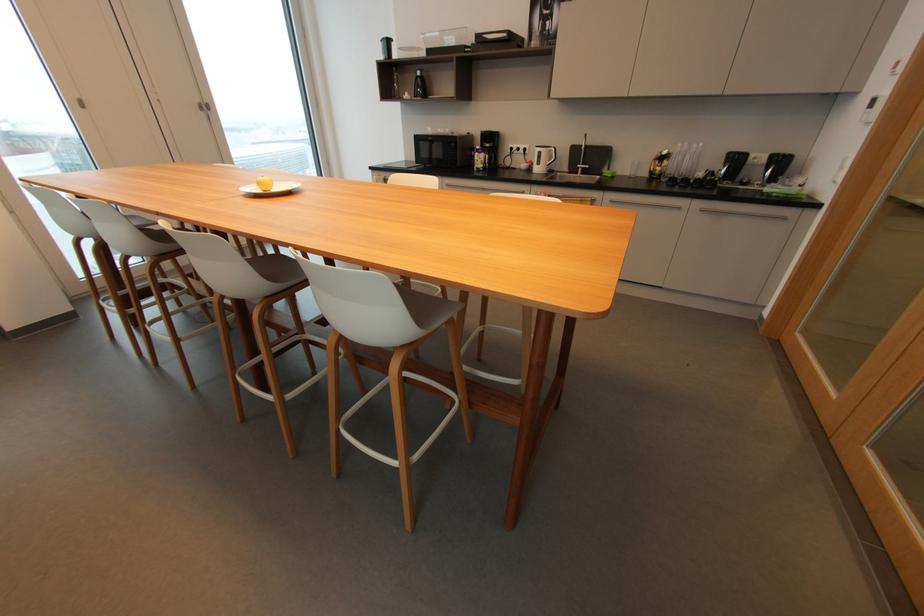
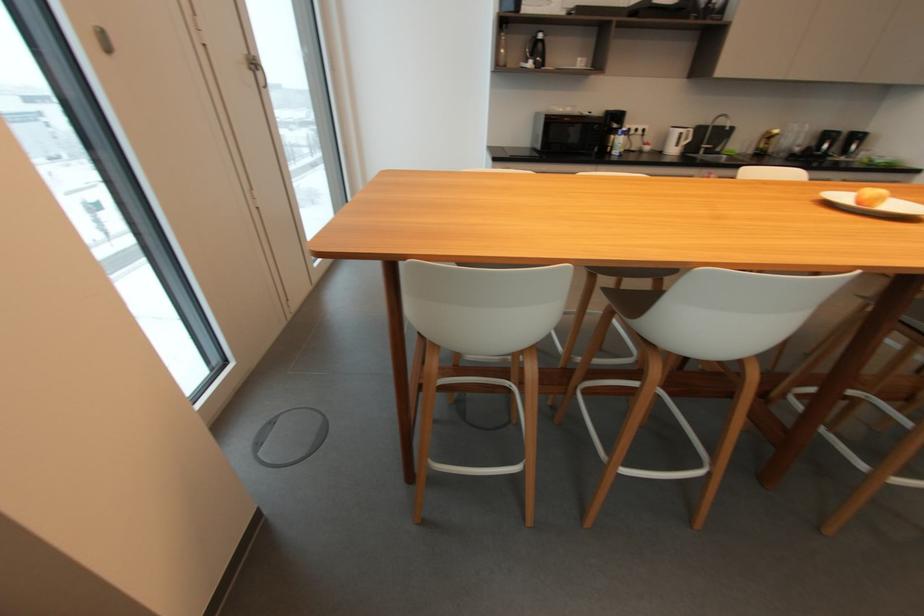
Find the pixel in the second image that matches pixel 542 153 in the first image.

(685, 134)